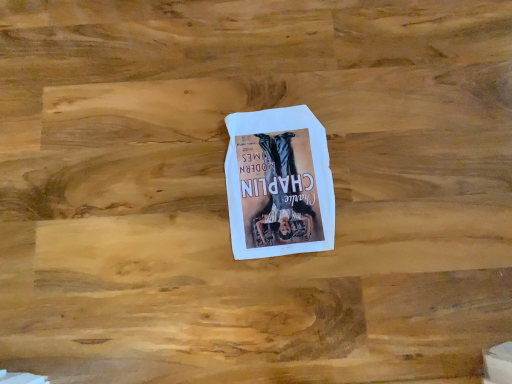
This screenshot has width=512, height=384. Identify the location of vacant area that is in front of white paper at center. (282, 302).